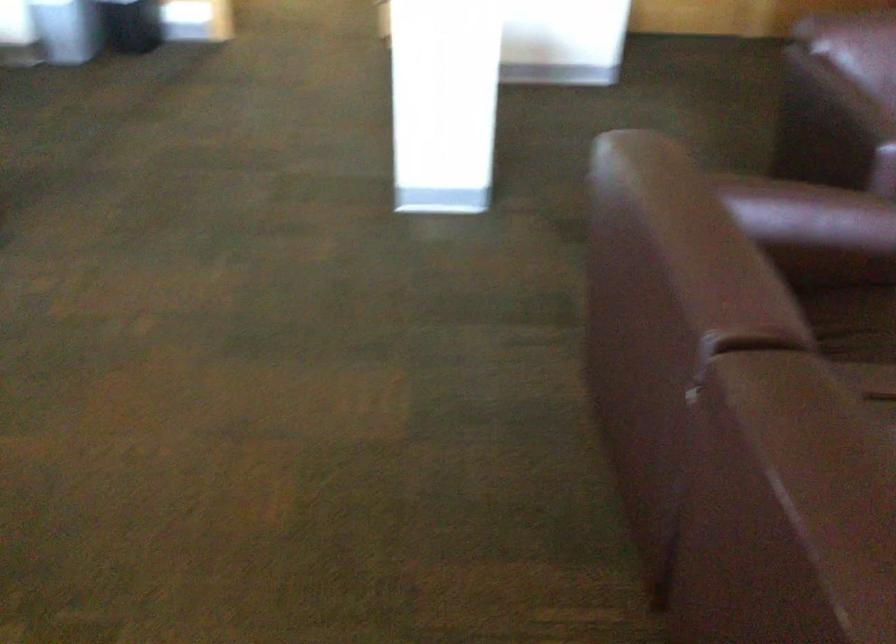
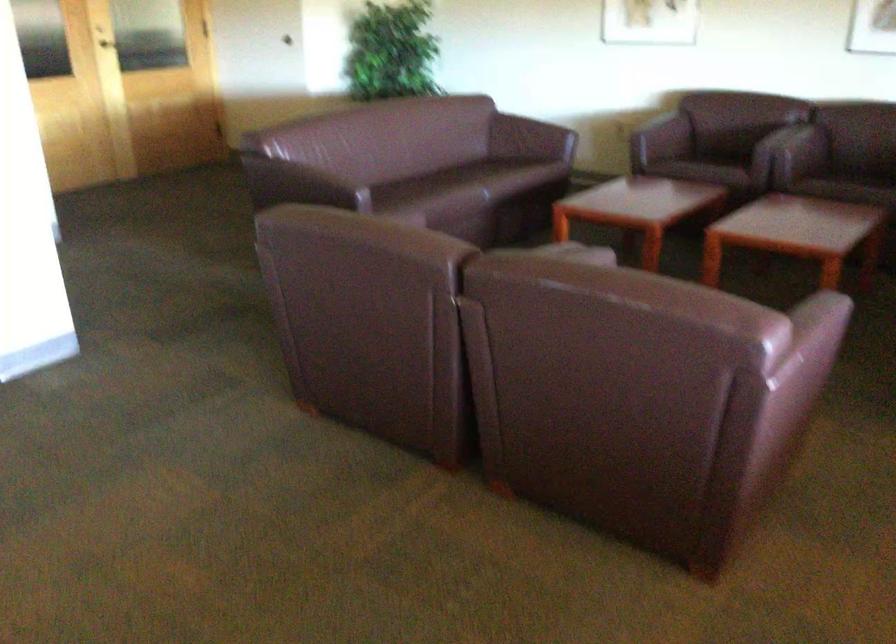
In the second image, find the point that corresponds to (x=824, y=109) in the first image.

(297, 184)